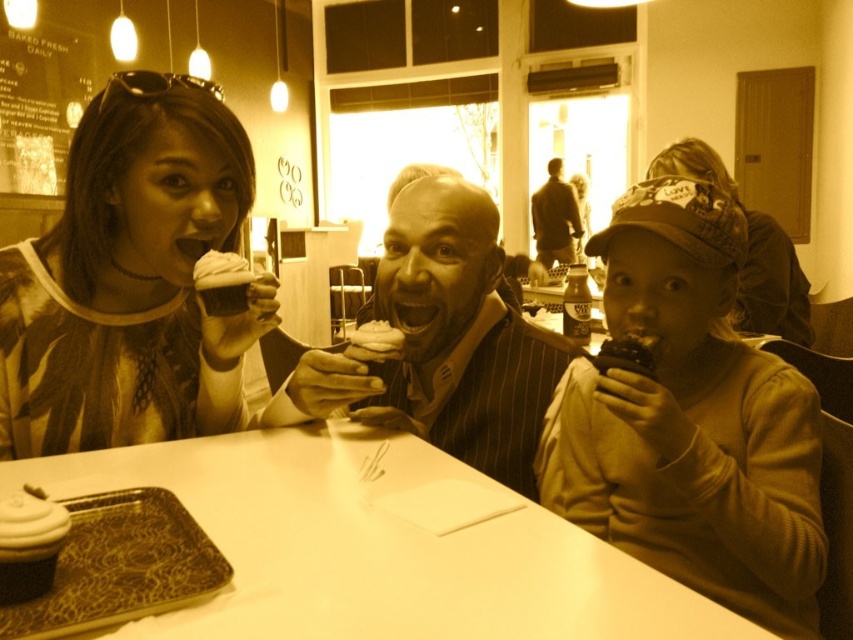
You are a customer at the bakery and want to place your new pastry box on the table without overlapping any existing items. Given the space occupied by the matte chocolate cupcake at lower left and the brown leather jacket at upper center, which object should you avoid placing the box near to ensure enough space?

You should avoid placing the box near the matte chocolate cupcake at lower left because it occupies less space than the brown leather jacket at upper center, meaning there is more space available near the jacket.

You are a delivery person who needs to place a new cupcake display case between the matte chocolate cupcake at lower left and the brown leather jacket at upper center. The display case requires a minimum of 15 feet of space. Based on the scene, can you safely install the display case in this location?

The distance between the matte chocolate cupcake at lower left and the brown leather jacket at upper center is 18.24 feet, which exceeds the required 15 feet. Therefore, the display case can be safely installed in this location.